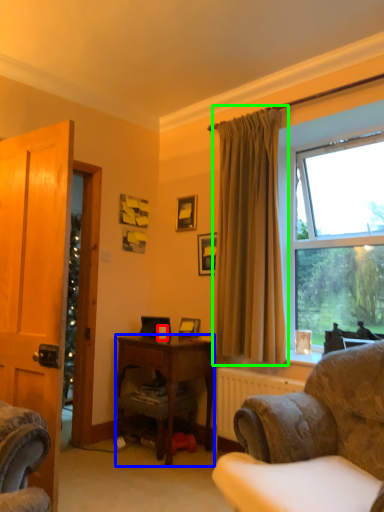
Question: Which object is positioned closest to coffee cup (highlighted by a red box)? Select from desk (highlighted by a blue box) and curtain (highlighted by a green box).

Choices:
 (A) desk
 (B) curtain

Answer: (A)